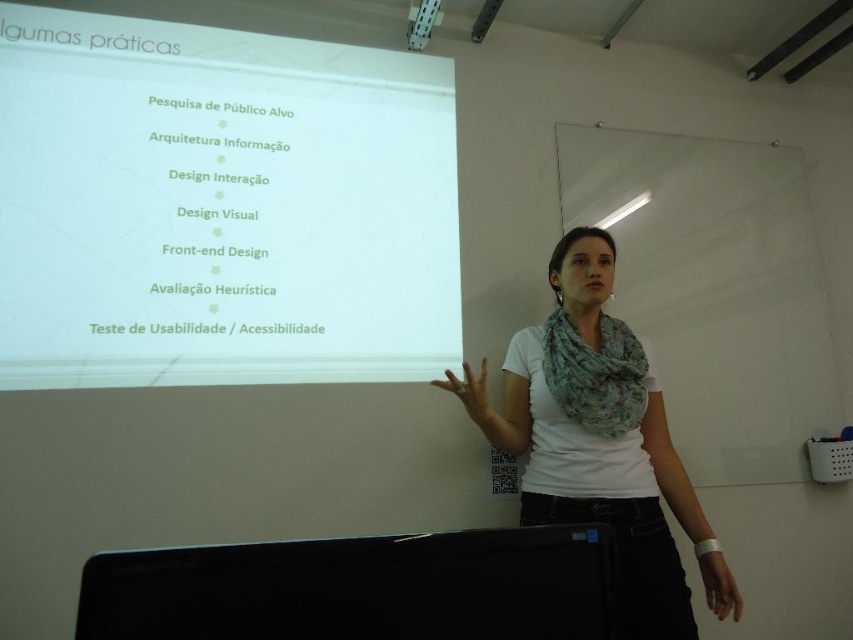
Question: Among these points, which one is farthest from the camera?

Choices:
 (A) (669, 460)
 (B) (20, 161)
 (C) (422, 20)

Answer: (C)

Question: Which object is positioned closest to the white matte projector screen at upper left?

Choices:
 (A) black glossy monitor at lower center
 (B) white fabric scarf at center

Answer: (B)

Question: Is white matte projector screen at upper left wider than white fabric scarf at center?

Choices:
 (A) yes
 (B) no

Answer: (A)

Question: Considering the relative positions of white fabric scarf at center and metallic projector at upper center in the image provided, where is white fabric scarf at center located with respect to metallic projector at upper center?

Choices:
 (A) below
 (B) above

Answer: (A)

Question: Among these points, which one is nearest to the camera?

Choices:
 (A) (437, 1)
 (B) (578, 513)
 (C) (302, 566)
 (D) (282, 49)

Answer: (C)

Question: Can you confirm if black glossy monitor at lower center is positioned above white fabric scarf at center?

Choices:
 (A) no
 (B) yes

Answer: (B)